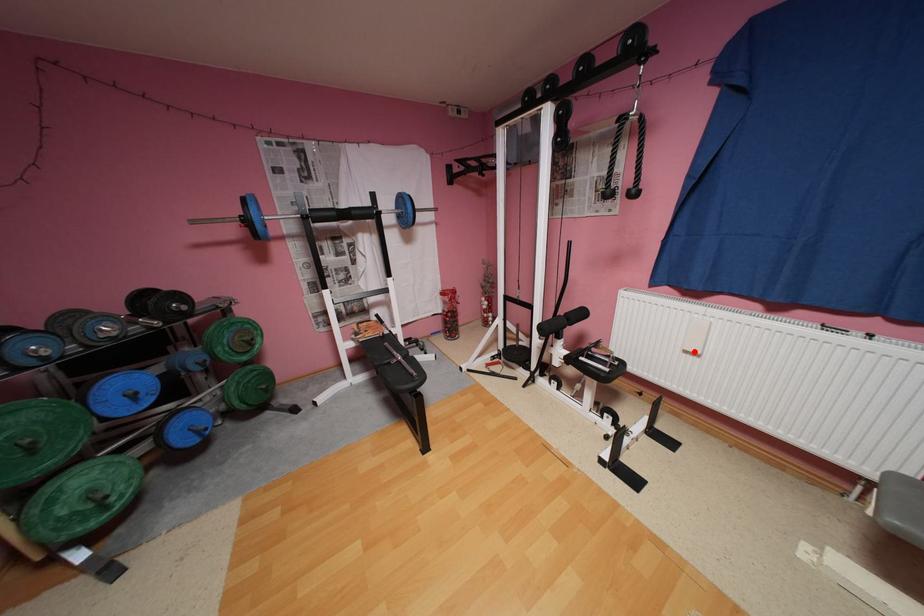
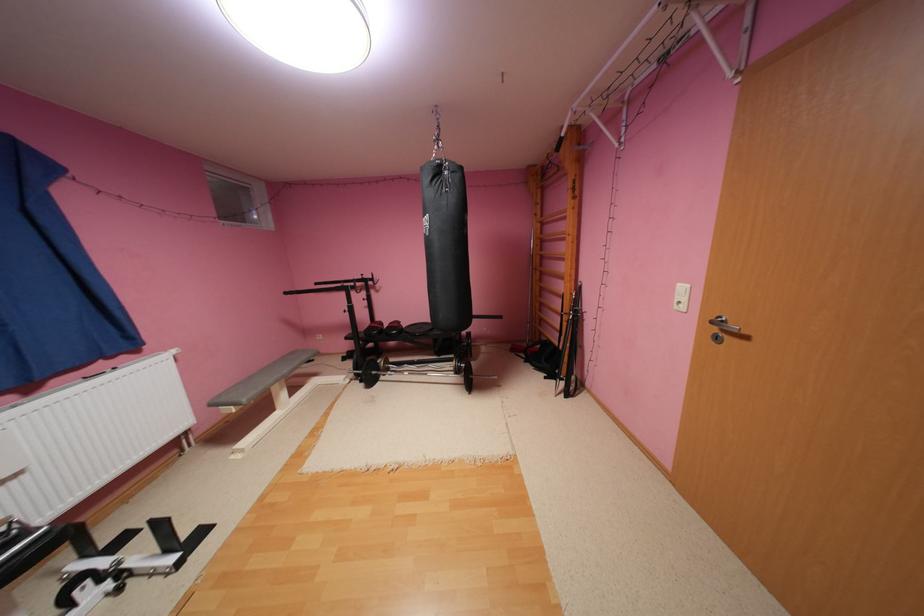
The point at the highlighted location is marked in the first image. Where is the corresponding point in the second image?

(11, 483)